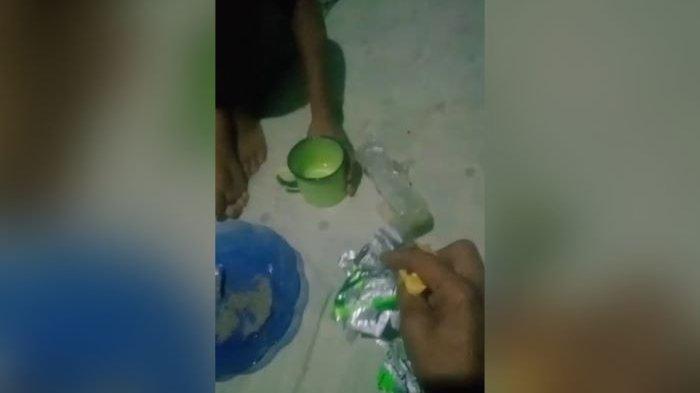
In order to click on green coffee cup in this screenshot , I will do `click(323, 181)`.